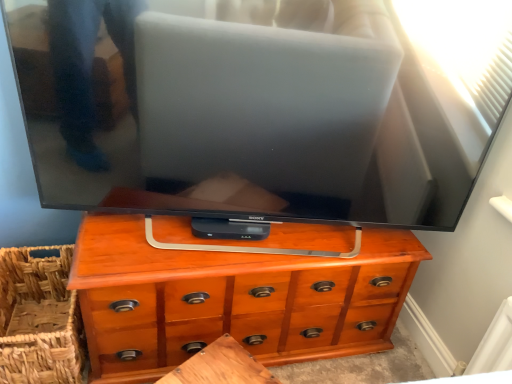
Question: Considering the positions of woven brown basket at lower left and wooden table at center in the image, is woven brown basket at lower left taller or shorter than wooden table at center?

Choices:
 (A) tall
 (B) short

Answer: (A)

Question: Based on their positions, is woven brown basket at lower left located to the left or right of wooden table at center?

Choices:
 (A) left
 (B) right

Answer: (A)

Question: Estimate the real-world distances between objects in this image. Which object is farther from the wooden table at center?

Choices:
 (A) wooden chest of drawers at center
 (B) woven brown basket at lower left

Answer: (B)

Question: Based on their relative distances, which object is farther from the wooden table at center?

Choices:
 (A) woven brown basket at lower left
 (B) wooden chest of drawers at center

Answer: (A)